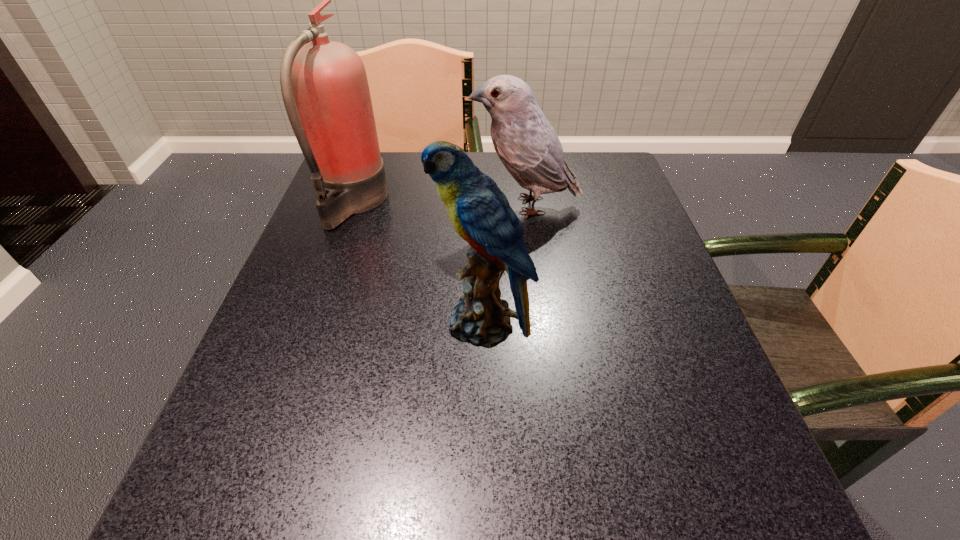
In the image, there is a desktop. Identify the location of free space at the far right corner. The image size is (960, 540). (583, 163).

Locate an element on the screen. vacant area between the tallest object and the nearest object is located at coordinates (418, 264).

This screenshot has width=960, height=540. Identify the location of vacant space that is in between the nearer parrot and the tallest object. (418, 264).

You are a GUI agent. You are given a task and a screenshot of the screen. Output one action in this format:
    pyautogui.click(x=<x>, y=<y>)
    Task: Click on the unoccupied area between the farther parrot and the leftmost object
    The image size is (960, 540).
    Given the screenshot: What is the action you would take?
    pyautogui.click(x=439, y=204)

Locate an element on the screen. free space between the nearer parrot and the fire extinguisher is located at coordinates (418, 264).

Locate an element on the screen. vacant area between the farther parrot and the leftmost object is located at coordinates (439, 204).

Where is `free spot between the farther parrot and the tallest object`? free spot between the farther parrot and the tallest object is located at coordinates (439, 204).

Choose which object is the second nearest neighbor to the farther parrot. Please provide its 2D coordinates. Your answer should be formatted as a tuple, i.e. [(x, y)], where the tuple contains the x and y coordinates of a point satisfying the conditions above.

[(480, 212)]

Choose which object is the second nearest neighbor to the nearest object. Please provide its 2D coordinates. Your answer should be formatted as a tuple, i.e. [(x, y)], where the tuple contains the x and y coordinates of a point satisfying the conditions above.

[(524, 140)]